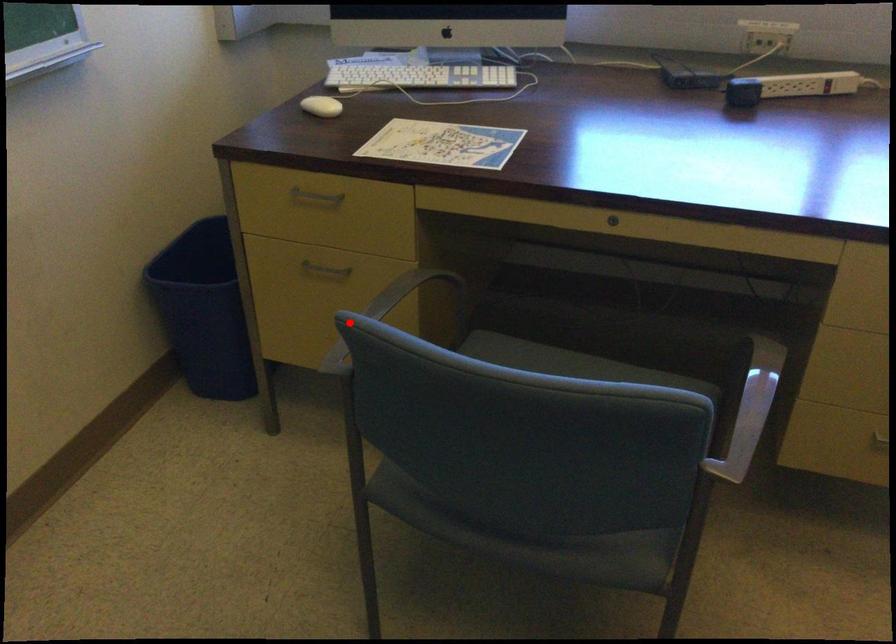
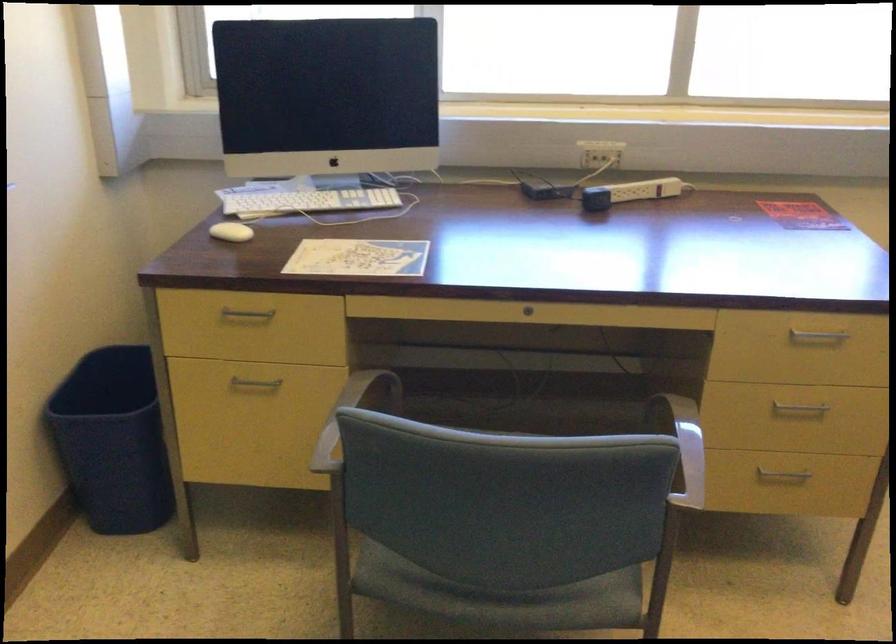
In the second image, find the point that corresponds to the highlighted location in the first image.

(350, 415)